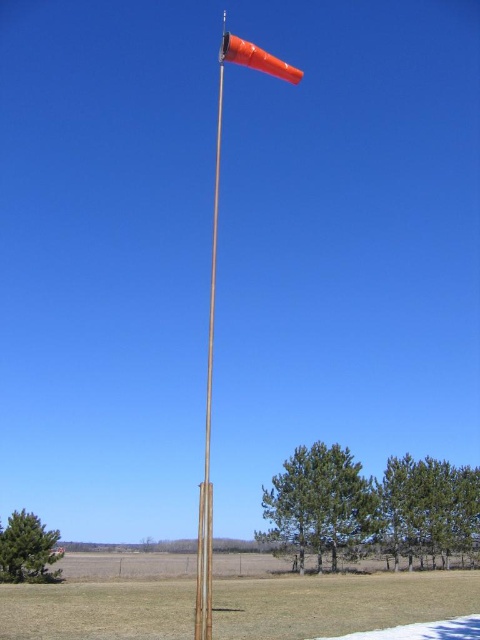
Question: Which point is farther from the camera taking this photo?

Choices:
 (A) (283, 65)
 (B) (215, 209)

Answer: (B)

Question: Does wooden flag pole at center lie behind orange matte windsock at upper center?

Choices:
 (A) no
 (B) yes

Answer: (A)

Question: Does wooden flag pole at center appear over orange matte windsock at upper center?

Choices:
 (A) yes
 (B) no

Answer: (B)

Question: Which point is closer to the camera?

Choices:
 (A) orange matte windsock at upper center
 (B) wooden flag pole at center

Answer: (B)

Question: Can you confirm if wooden flag pole at center is positioned to the left of orange matte windsock at upper center?

Choices:
 (A) no
 (B) yes

Answer: (B)